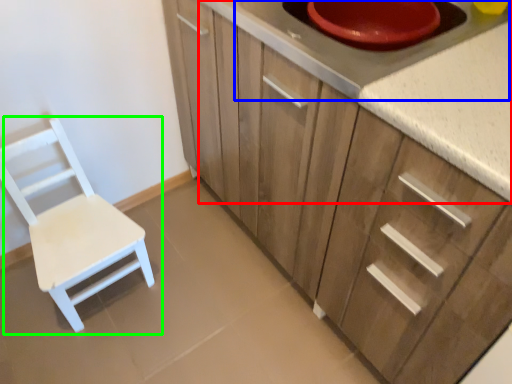
Question: Considering the real-world distances, which object is farthest from countertop (highlighted by a red box)? appliance (highlighted by a blue box) or chair (highlighted by a green box)?

Choices:
 (A) appliance
 (B) chair

Answer: (B)